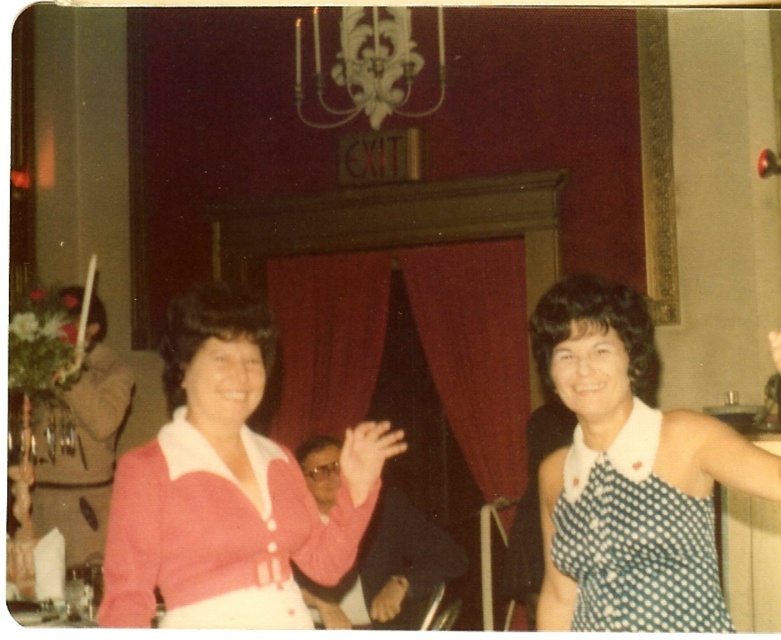
You are a photographer at the event and want to capture a photo that includes both the white polka dot dress at center and the white polka dot dress at right. Based on their positions, which dress should you focus on first to ensure both are in frame?

The white polka dot dress at center is located above the white polka dot dress at right, so focusing on the dress at center first will allow you to frame both dresses by adjusting the camera angle downward to include the dress at right.

You are a photographer at the event and want to capture a photo of the white polka dot dress at right and the brown leather handbag at lower center. Which object is positioned higher in the frame?

The white polka dot dress at right is positioned higher in the frame than the brown leather handbag at lower center.